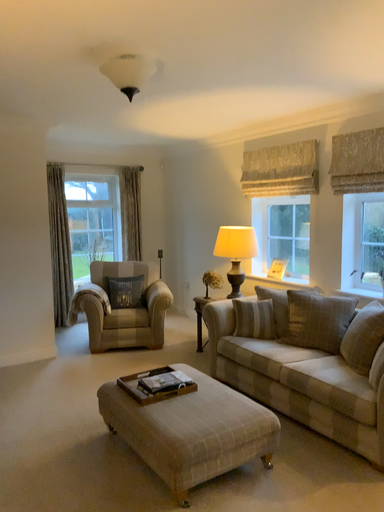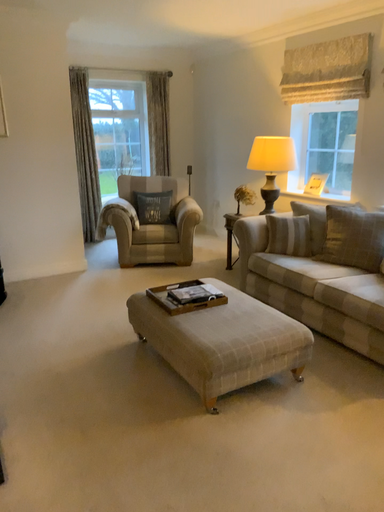
Question: How did the camera likely rotate when shooting the video?

Choices:
 (A) rotated downward
 (B) rotated upward

Answer: (A)